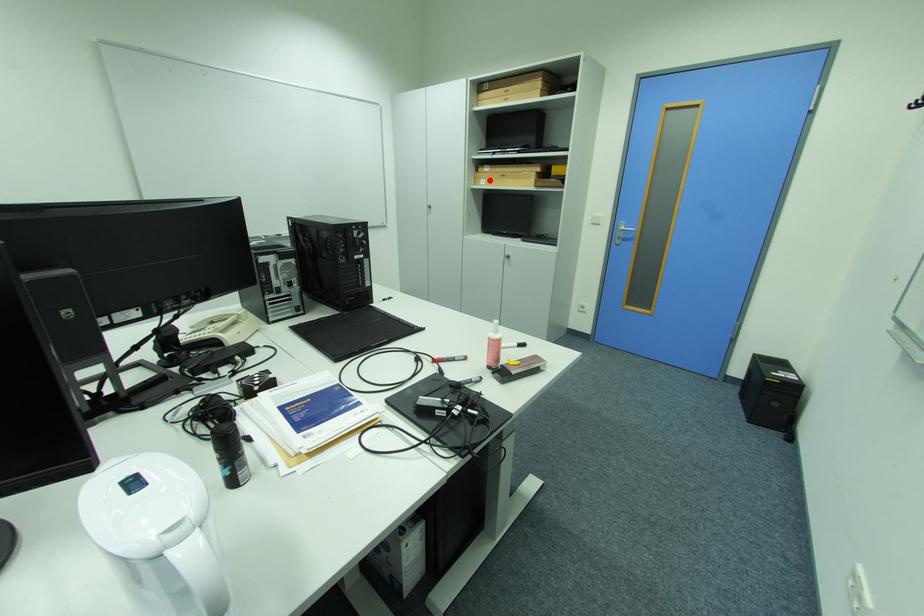
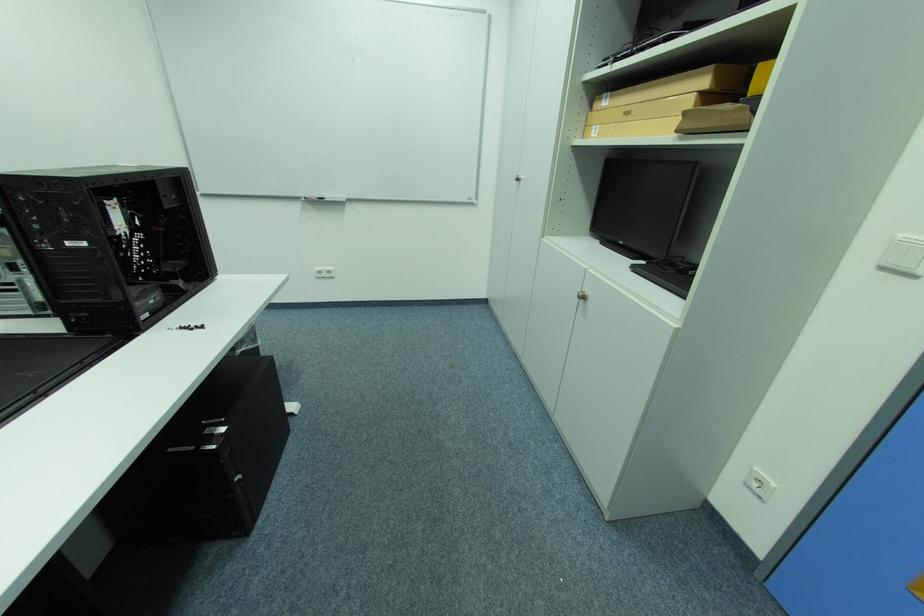
In the second image, find the point that corresponds to the highlighted location in the first image.

(602, 128)